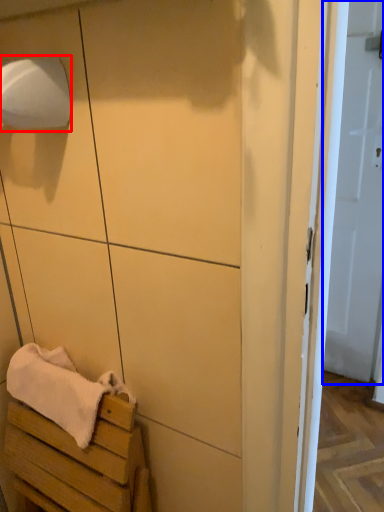
Question: Which object is closer to the camera taking this photo, toilet paper (highlighted by a red box) or door (highlighted by a blue box)?

Choices:
 (A) toilet paper
 (B) door

Answer: (A)